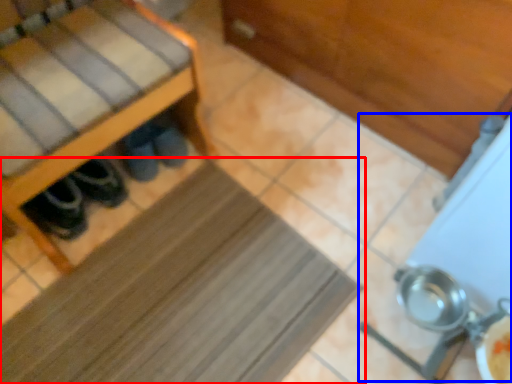
Question: Which object is further to the camera taking this photo, mat (highlighted by a red box) or wide (highlighted by a blue box)?

Choices:
 (A) mat
 (B) wide

Answer: (A)